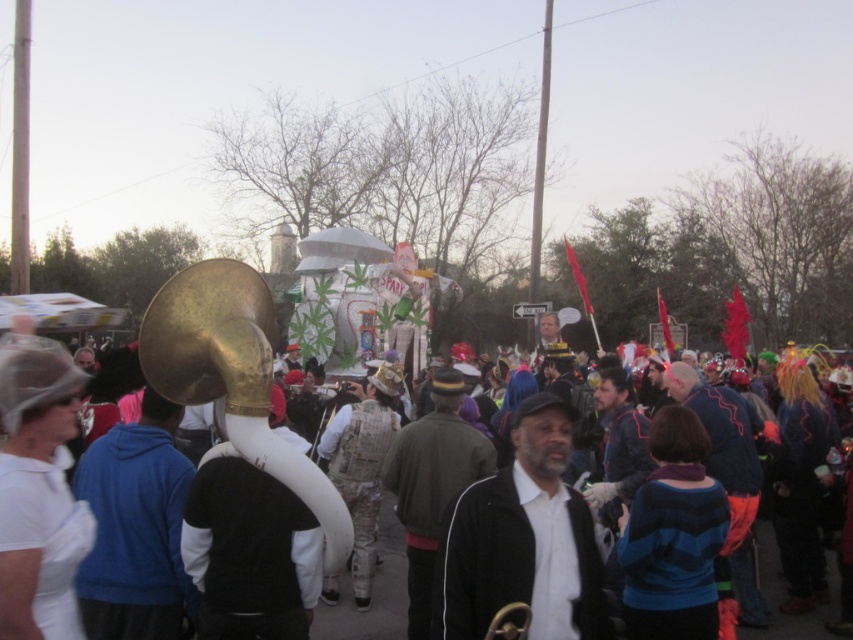
Question: Observing the image, what is the correct spatial positioning of dark green jacket at center in reference to white matte crowd at center?

Choices:
 (A) left
 (B) right

Answer: (B)

Question: Is blue fleece jacket at center to the left of dark green jacket at center from the viewer's perspective?

Choices:
 (A) yes
 (B) no

Answer: (A)

Question: Does dark green jacket at center have a lesser width compared to white matte crowd at center?

Choices:
 (A) yes
 (B) no

Answer: (A)

Question: Which object is farther from the camera taking this photo?

Choices:
 (A) black matte jacket at center
 (B) white matte crowd at center

Answer: (A)

Question: Which object appears closest to the camera in this image?

Choices:
 (A) blue fleece jacket at center
 (B) black matte jacket at center
 (C) white matte crowd at center

Answer: (C)

Question: Among these objects, which one is nearest to the camera?

Choices:
 (A) gold shiny bass horn at center
 (B) black matte jacket at center
 (C) white matte crowd at center

Answer: (C)